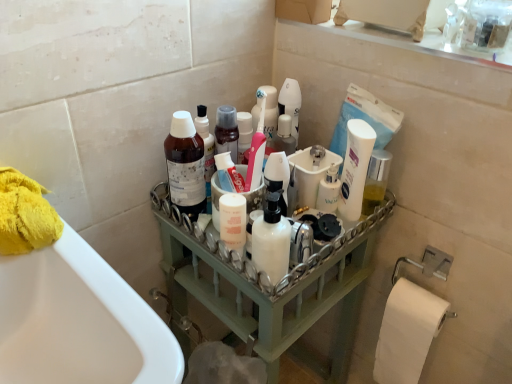
Locate an element on the screen. The width and height of the screenshot is (512, 384). white glossy pump bottle at center is located at coordinates (329, 190).

The image size is (512, 384). I want to click on translucent plastic bottle at upper center, the 2th cleaning product from the right, so click(185, 165).

Describe the element at coordinates (355, 168) in the screenshot. The image size is (512, 384). I see `white glossy mouthwash at center` at that location.

The width and height of the screenshot is (512, 384). Describe the element at coordinates (270, 289) in the screenshot. I see `green wood tray at center` at that location.

I want to click on yellow fluffy towel at left, so click(x=25, y=214).

Can you confirm if white glossy pump bottle at center is shorter than translucent plastic bottle at upper center, the 2th cleaning product from the right?

Yes, white glossy pump bottle at center is shorter than translucent plastic bottle at upper center, the 2th cleaning product from the right.

In order to click on the 1st cleaning product in front of the white glossy pump bottle at center in this screenshot , I will do `click(185, 165)`.

Is white glossy pump bottle at center oriented away from translucent plastic bottle at upper center, acting as the first cleaning product starting from the left?

No, white glossy pump bottle at center is not facing the opposite direction of translucent plastic bottle at upper center, acting as the first cleaning product starting from the left.

From a real-world perspective, is yellow fluffy towel at left above or below green wood tray at center?

Clearly, from a real-world perspective, yellow fluffy towel at left is above green wood tray at center.

From the image's perspective, is yellow fluffy towel at left located beneath green wood tray at center?

Actually, yellow fluffy towel at left appears above green wood tray at center in the image.

Is point (12, 184) behind point (300, 357)?

No, it is in front of (300, 357).

Is yellow fluffy towel at left bigger than green wood tray at center?

No.

Considering the positions of point (180, 152) and point (334, 205), is point (180, 152) closer or farther from the camera than point (334, 205)?

Point (180, 152) is positioned closer to the camera compared to point (334, 205).

Consider the image. Considering the sizes of translucent plastic bottle at upper center, acting as the first cleaning product starting from the left, and white glossy pump bottle at center in the image, is translucent plastic bottle at upper center, acting as the first cleaning product starting from the left, taller or shorter than white glossy pump bottle at center?

Clearly, translucent plastic bottle at upper center, acting as the first cleaning product starting from the left, is taller compared to white glossy pump bottle at center.

From the image's perspective, which one is positioned higher, translucent plastic bottle at upper center, acting as the first cleaning product starting from the left, or white glossy pump bottle at center?

translucent plastic bottle at upper center, acting as the first cleaning product starting from the left, from the image's perspective.

Is translucent plastic bottle at upper center, the first cleaning product positioned from the back, to the left of white glossy pump bottle at center from the viewer's perspective?

Indeed, translucent plastic bottle at upper center, the first cleaning product positioned from the back, is positioned on the left side of white glossy pump bottle at center.

Is yellow fluffy towel at left closer to camera compared to translucent plastic bottle at upper center, acting as the first cleaning product starting from the left?

Yes, it is in front of translucent plastic bottle at upper center, acting as the first cleaning product starting from the left.

Which is farther, (7, 219) or (180, 198)?

The point (180, 198) is farther from the camera.

Do you think yellow fluffy towel at left is within translucent plastic bottle at upper center, the first cleaning product positioned from the back, or outside of it?

yellow fluffy towel at left exists outside the volume of translucent plastic bottle at upper center, the first cleaning product positioned from the back.

Could you tell me if yellow fluffy towel at left is facing translucent plastic bottle at upper center, the 2th cleaning product from the right?

No.

Locate an element on the screen. This screenshot has height=384, width=512. toiletry behind the white matte pump bottle at center, the second cleaning product viewed from the back is located at coordinates (329, 190).

Is white matte pump bottle at center, the first cleaning product when ordered from right to left, facing away from white glossy pump bottle at center?

Absolutely, white matte pump bottle at center, the first cleaning product when ordered from right to left, is directed away from white glossy pump bottle at center.

Considering the positions of objects white matte pump bottle at center, placed as the first cleaning product when sorted from front to back, and white glossy pump bottle at center in the image provided, who is in front, white matte pump bottle at center, placed as the first cleaning product when sorted from front to back, or white glossy pump bottle at center?

white matte pump bottle at center, placed as the first cleaning product when sorted from front to back, is in front.

What's the angular difference between white matte pump bottle at center, the second cleaning product when ordered from left to right, and white glossy pump bottle at center's facing directions?

The facing directions of white matte pump bottle at center, the second cleaning product when ordered from left to right, and white glossy pump bottle at center are 1.15 degrees apart.

In the image, is white glossy mouthwash at center on the left side or the right side of green wood tray at center?

Based on their positions, white glossy mouthwash at center is located to the right of green wood tray at center.

Find the location of a particular element. This screenshot has height=384, width=512. balustrade on the left of white glossy mouthwash at center is located at coordinates (270, 289).

Can you tell me how much white glossy mouthwash at center and green wood tray at center differ in facing direction?

36.6 degrees.

In the scene shown: In the image, is white glossy mouthwash at center positioned in front of or behind green wood tray at center?

white glossy mouthwash at center is positioned farther from the viewer than green wood tray at center.

At what (x,y) coordinates should I click in order to perform the action: click on the 1st cleaning product above when counting from the green wood tray at center (from the image's perspective). Please return your answer as a coordinate pair (x, y). The width and height of the screenshot is (512, 384). Looking at the image, I should click on (271, 236).

Is white matte pump bottle at center, the second cleaning product viewed from the back, inside the boundaries of green wood tray at center, or outside?

white matte pump bottle at center, the second cleaning product viewed from the back, is outside green wood tray at center.

Is point (280, 254) farther from viewer compared to point (347, 282)?

No, (280, 254) is in front of (347, 282).

From a real-world perspective, count 2nd cleaning products upward from the white glossy pump bottle at center and point to it. Please provide its 2D coordinates.

[(185, 165)]

Find the location of a particular element. toilet paper on the left side of green wood tray at center is located at coordinates (25, 214).

Based on their spatial positions, is white glossy pump bottle at center or green wood tray at center further from translucent plastic bottle at upper center, the 2th cleaning product from the right?

white glossy pump bottle at center is positioned further to the anchor translucent plastic bottle at upper center, the 2th cleaning product from the right.

Looking at this image, based on their spatial positions, is translucent plastic bottle at upper center, the first cleaning product positioned from the back, or yellow fluffy towel at left further from white glossy mouthwash at center?

yellow fluffy towel at left is positioned further to the anchor white glossy mouthwash at center.

Which object lies further to the anchor point white glossy mouthwash at center, yellow fluffy towel at left or white matte pump bottle at center, the second cleaning product when ordered from left to right?

The object further to white glossy mouthwash at center is yellow fluffy towel at left.

When comparing their distances from white glossy mouthwash at center, does green wood tray at center or white glossy pump bottle at center seem further?

green wood tray at center is further to white glossy mouthwash at center.

Estimate the real-world distances between objects in this image. Which object is further from green wood tray at center, yellow fluffy towel at left or white matte pump bottle at center, placed as the first cleaning product when sorted from front to back?

The object further to green wood tray at center is yellow fluffy towel at left.

Estimate the real-world distances between objects in this image. Which object is closer to white glossy pump bottle at center, translucent plastic bottle at upper center, the 2th cleaning product from the right, or green wood tray at center?

translucent plastic bottle at upper center, the 2th cleaning product from the right, lies closer to white glossy pump bottle at center than the other object.

Looking at this image, estimate the real-world distances between objects in this image. Which object is further from yellow fluffy towel at left, green wood tray at center or white matte pump bottle at center, the second cleaning product viewed from the back?

Based on the image, green wood tray at center appears to be further to yellow fluffy towel at left.

When comparing their distances from white glossy mouthwash at center, does yellow fluffy towel at left or white glossy pump bottle at center seem closer?

white glossy pump bottle at center lies closer to white glossy mouthwash at center than the other object.

The height and width of the screenshot is (384, 512). What are the coordinates of `toiletry situated between yellow fluffy towel at left and white glossy mouthwash at center from left to right` in the screenshot? It's located at (329, 190).

The width and height of the screenshot is (512, 384). Find the location of `toiletry between translucent plastic bottle at upper center, the first cleaning product positioned from the back, and green wood tray at center from top to bottom`. toiletry between translucent plastic bottle at upper center, the first cleaning product positioned from the back, and green wood tray at center from top to bottom is located at coordinates (329, 190).

This screenshot has height=384, width=512. I want to click on toilet paper between translucent plastic bottle at upper center, the second cleaning product viewed from the front, and green wood tray at center, in the vertical direction, so click(x=25, y=214).

I want to click on toiletry between white glossy mouthwash at center and green wood tray at center vertically, so click(x=329, y=190).